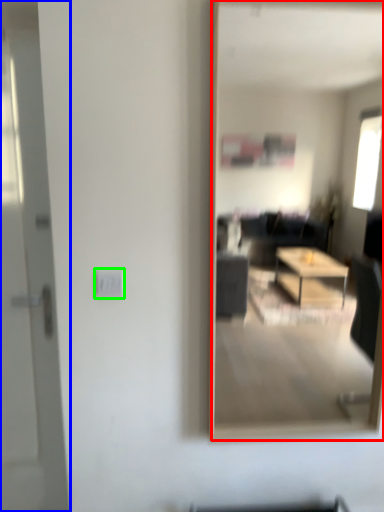
Question: Which is nearer to the mirror (highlighted by a red box)? door (highlighted by a blue box) or electric outlet (highlighted by a green box).

Choices:
 (A) door
 (B) electric outlet

Answer: (A)